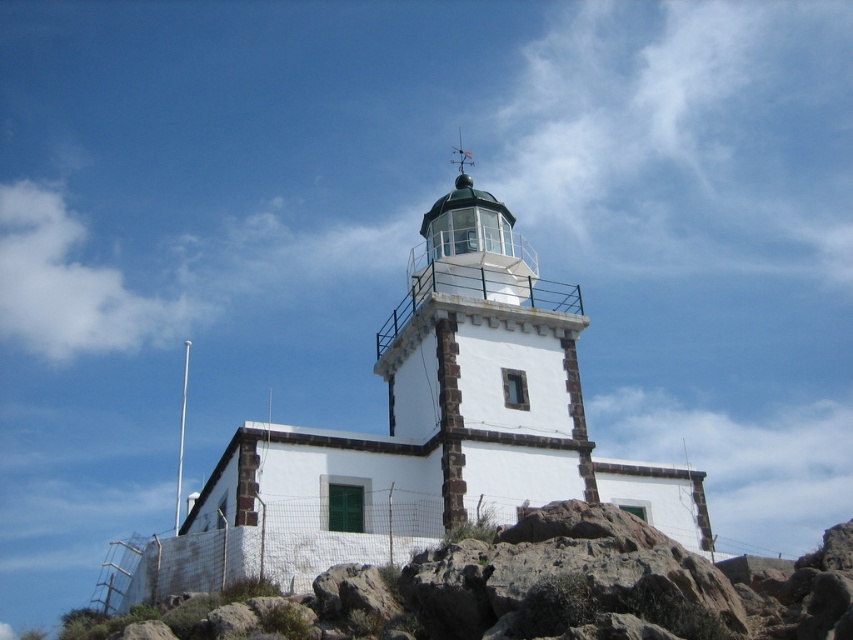
Based on the photo, who is shorter, rocky terrain at lower right or white stone lighthouse at center?

Standing shorter between the two is rocky terrain at lower right.

Is rocky terrain at lower right bigger than white stone lighthouse at center?

No.

Between point (602, 556) and point (518, 440), which one is positioned in front?

Positioned in front is point (602, 556).

Locate an element on the screen. The image size is (853, 640). rocky terrain at lower right is located at coordinates (538, 592).